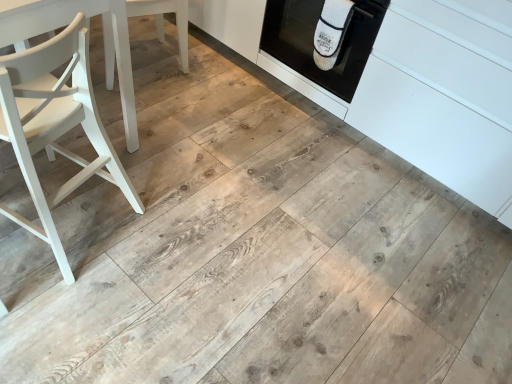
You are a GUI agent. You are given a task and a screenshot of the screen. Output one action in this format:
    pyautogui.click(x=<x>, y=<y>)
    Task: Click on the free space in front of white painted wood chair at left, the 2th chair viewed from the back
    
    Given the screenshot: What is the action you would take?
    pyautogui.click(x=52, y=312)